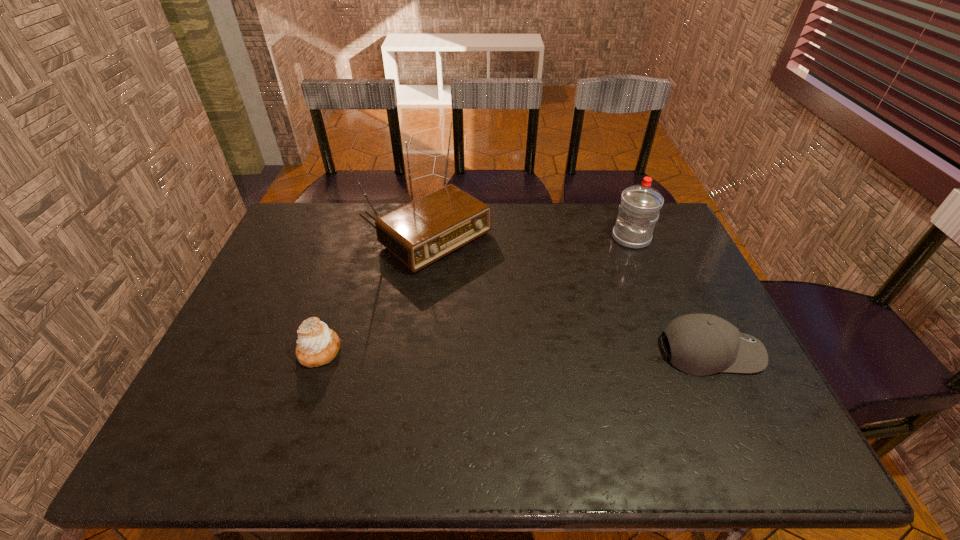
Where is `free region at the far left corner`? free region at the far left corner is located at coordinates (308, 217).

You are a GUI agent. You are given a task and a screenshot of the screen. Output one action in this format:
    pyautogui.click(x=<x>, y=<y>)
    Task: Click on the free space between the tallest object and the baseball cap
    
    Given the screenshot: What is the action you would take?
    pyautogui.click(x=565, y=294)

Image resolution: width=960 pixels, height=540 pixels. I want to click on vacant point located between the tallest object and the second tallest object, so click(526, 238).

Find the location of a particular element. The height and width of the screenshot is (540, 960). free space between the third shortest object and the pastry is located at coordinates [475, 294].

Locate an element on the screen. The height and width of the screenshot is (540, 960). vacant area between the pastry and the tallest object is located at coordinates (371, 294).

The image size is (960, 540). Identify the location of free space that is in between the third tallest object and the pastry. (515, 351).

At what (x,y) coordinates should I click in order to perform the action: click on free space between the third tallest object and the pastry. Please return your answer as a coordinate pair (x, y). Looking at the image, I should click on (515, 351).

Find the location of `free area in between the third tallest object and the water bottle`. free area in between the third tallest object and the water bottle is located at coordinates (670, 295).

The width and height of the screenshot is (960, 540). Identify the location of vacant region between the second tallest object and the pastry. (475, 294).

Identify the location of free space between the third tallest object and the shortest object. This screenshot has width=960, height=540. (515, 351).